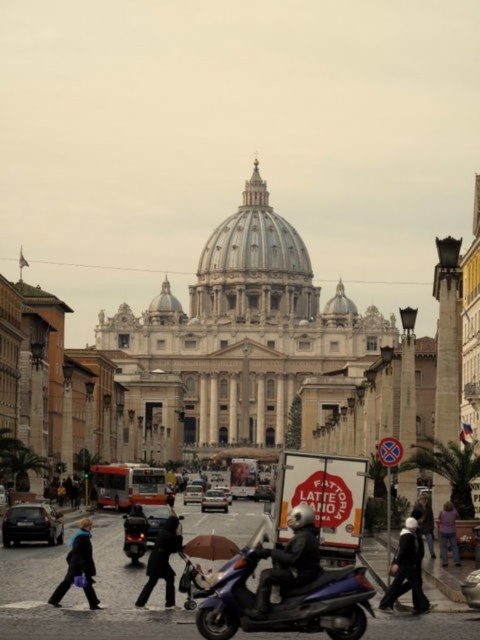
Between pink fabric jacket at lower right and white matte car at center, which one is positioned lower?

white matte car at center is below.

Can you confirm if pink fabric jacket at lower right is positioned to the left of white matte car at center?

Incorrect, pink fabric jacket at lower right is not on the left side of white matte car at center.

Locate an element on the screen. Image resolution: width=480 pixels, height=640 pixels. pink fabric jacket at lower right is located at coordinates (447, 532).

Which is behind, point (263, 237) or point (423, 509)?

The point (263, 237) is more distant.

Who is higher up, white marble cathedral at center or dark gray jacket at lower right?

white marble cathedral at center is above.

Does point (342, 288) lie in front of point (420, 499)?

No, (342, 288) is behind (420, 499).

Where is `white marble cathedral at center`? The width and height of the screenshot is (480, 640). white marble cathedral at center is located at coordinates (x=243, y=330).

Based on the photo, is metallic purple scooter at center to the right of blue fabric jacket at lower left from the viewer's perspective?

Correct, you'll find metallic purple scooter at center to the right of blue fabric jacket at lower left.

Who is more distant from viewer, [224,609] or [56,605]?

The point [56,605] is behind.

Between point (305, 544) and point (82, 524), which one is positioned in front?

Positioned in front is point (305, 544).

Where is `metallic purple scooter at center`? Image resolution: width=480 pixels, height=640 pixels. metallic purple scooter at center is located at coordinates (287, 593).